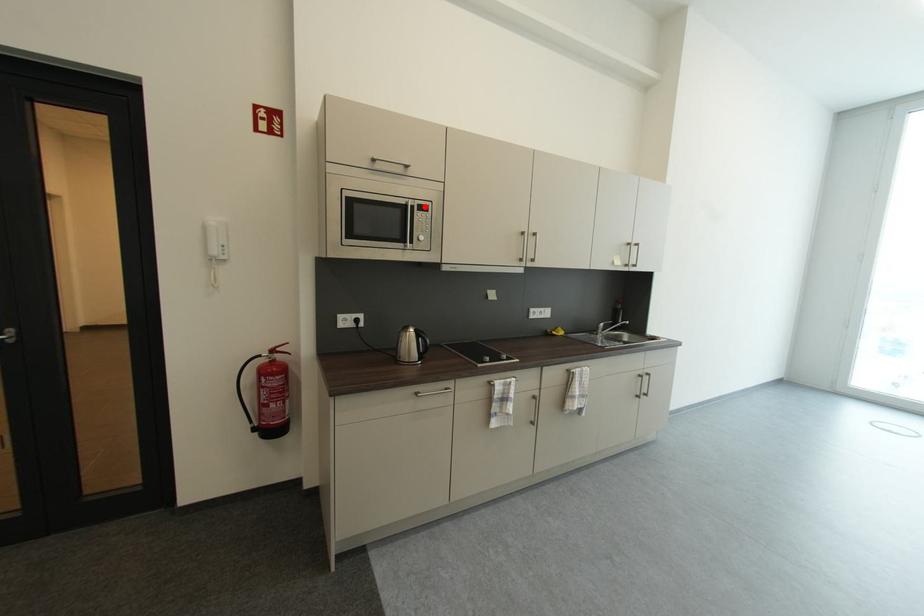
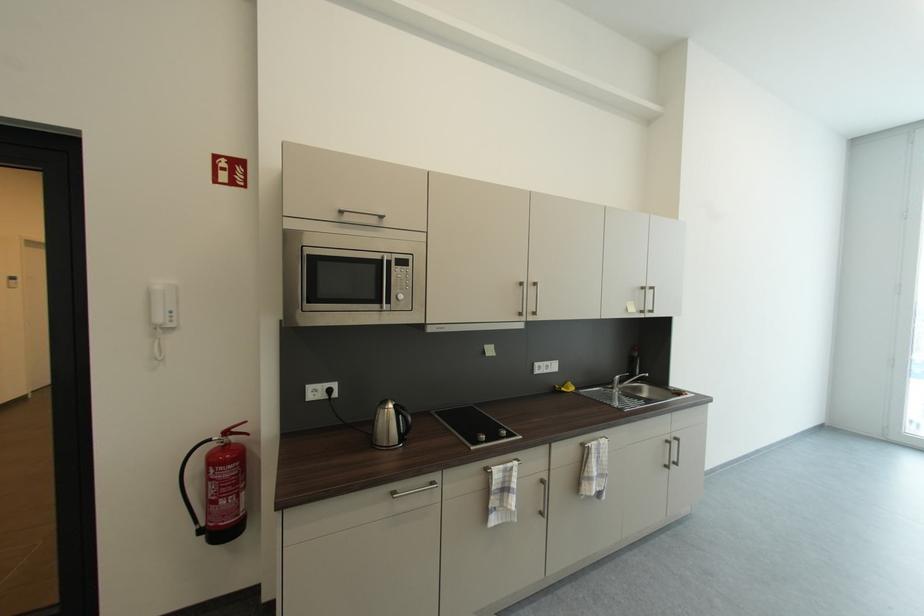
Find the pixel in the second image that matches the highlighted location in the first image.

(403, 261)